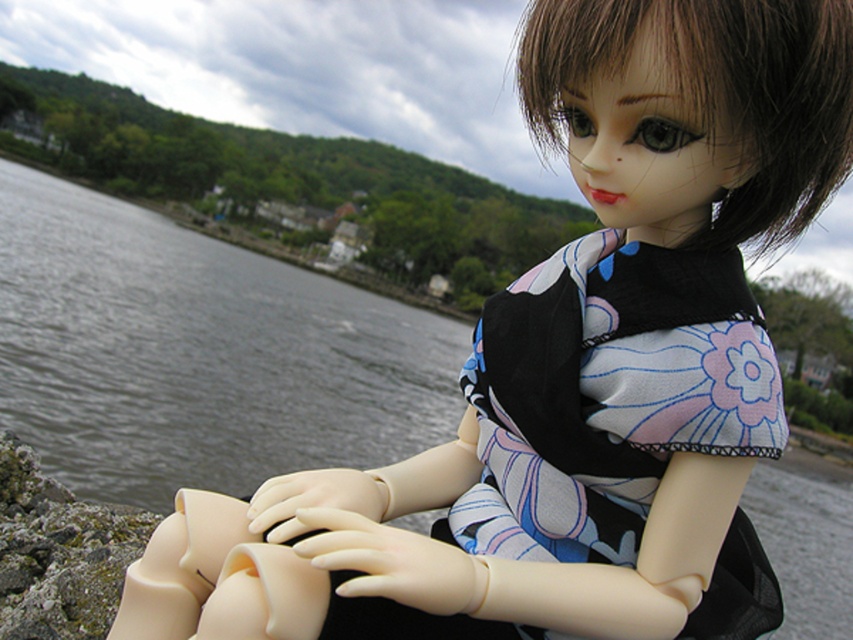
The width and height of the screenshot is (853, 640). Describe the element at coordinates (198, 355) in the screenshot. I see `gray water at left` at that location.

Which of these two, gray water at left or silky floral dress at center, stands taller?

gray water at left

What are the coordinates of `gray water at left` in the screenshot? It's located at (198, 355).